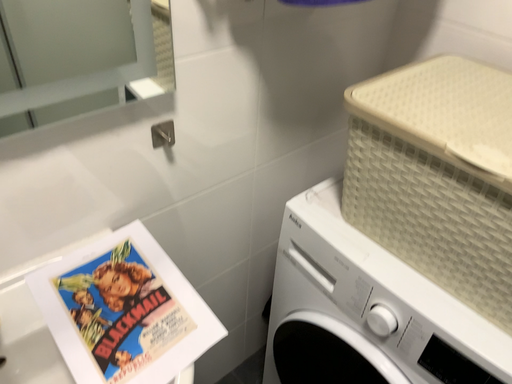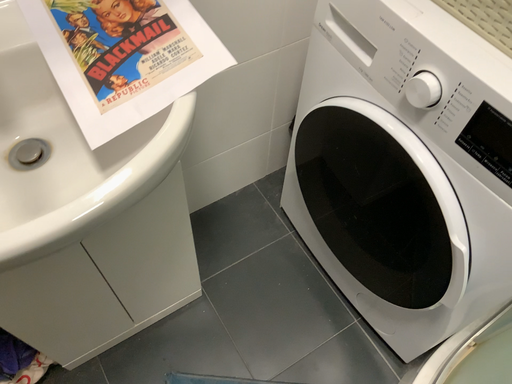
Question: Which way did the camera rotate in the video?

Choices:
 (A) rotated upward
 (B) rotated downward

Answer: (B)